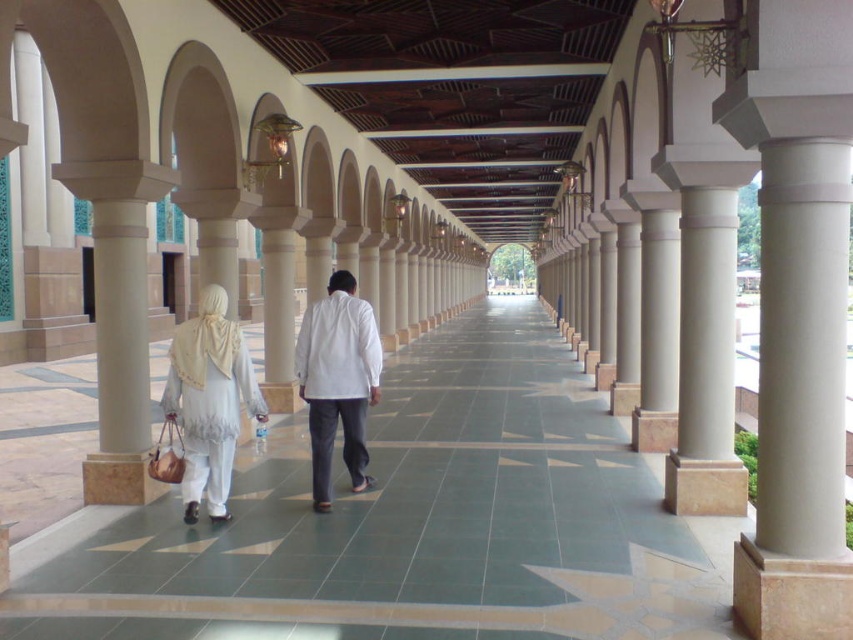
Which of these two, light beige fabric dress at center or white matte shirt at center, stands taller?

white matte shirt at center

Who is shorter, light beige fabric dress at center or white matte shirt at center?

Standing shorter between the two is light beige fabric dress at center.

Identify the location of light beige fabric dress at center. (207, 403).

Can you confirm if smooth stone corridor at center is thinner than white matte shirt at center?

No.

In the scene shown: Is smooth stone corridor at center further to the viewer compared to white matte shirt at center?

That is False.

Which is behind, point (476, 573) or point (347, 380)?

Positioned behind is point (347, 380).

This screenshot has width=853, height=640. What are the coordinates of `smooth stone corridor at center` in the screenshot? It's located at (410, 524).

Who is taller, smooth stone corridor at center or white matte/soft fabric dress at left?

With more height is white matte/soft fabric dress at left.

Which is below, smooth stone corridor at center or white matte/soft fabric dress at left?

smooth stone corridor at center is below.

Is point (440, 333) positioned behind point (170, 358)?

Yes, point (440, 333) is farther from viewer.

Where is `smooth stone corridor at center`? smooth stone corridor at center is located at coordinates (410, 524).